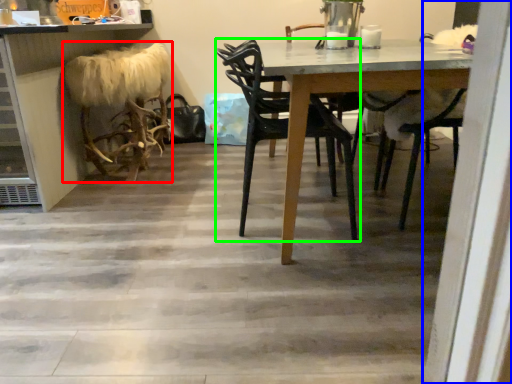
Question: Based on their relative distances, which object is nearer to animal (highlighted by a red box)? Choose from screen door (highlighted by a blue box) and chair (highlighted by a green box).

Choices:
 (A) screen door
 (B) chair

Answer: (B)